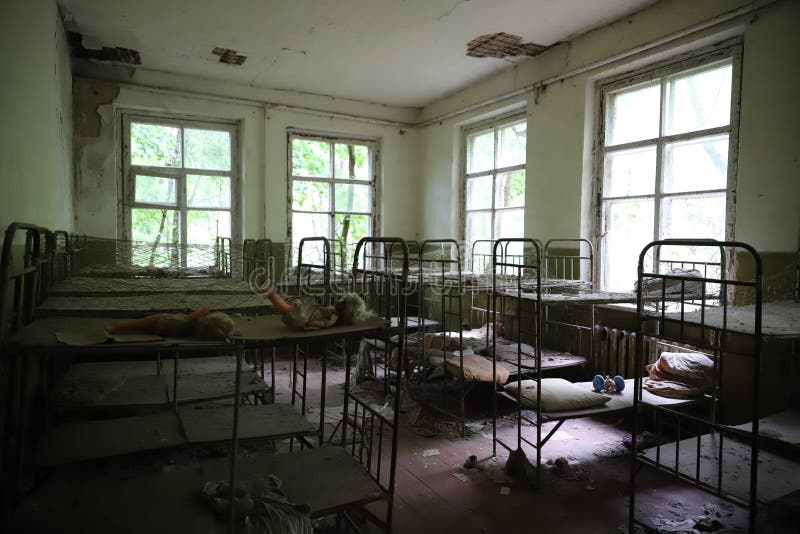
Find the location of `window pane`. window pane is located at coordinates (642, 108), (485, 145), (360, 161), (206, 227), (312, 232), (488, 232), (616, 232).